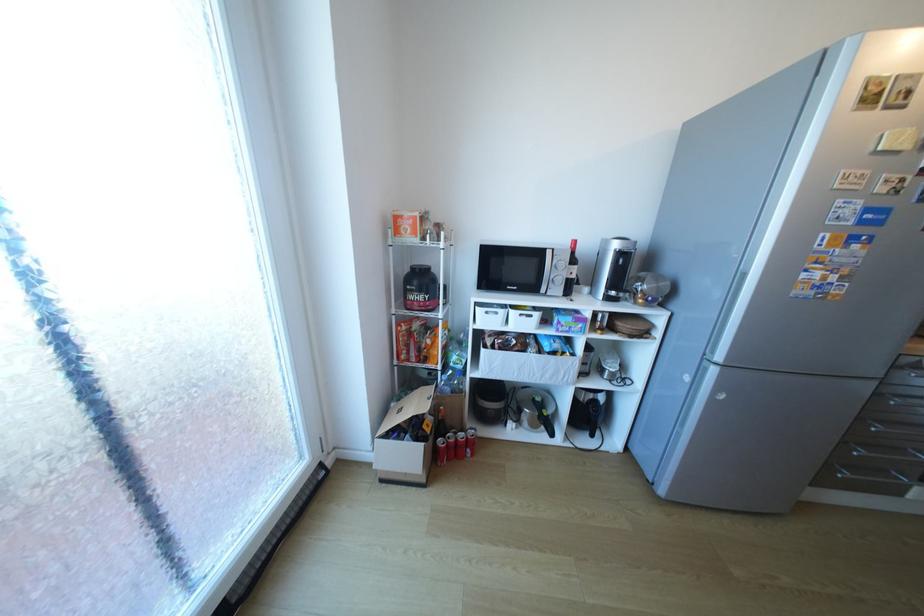
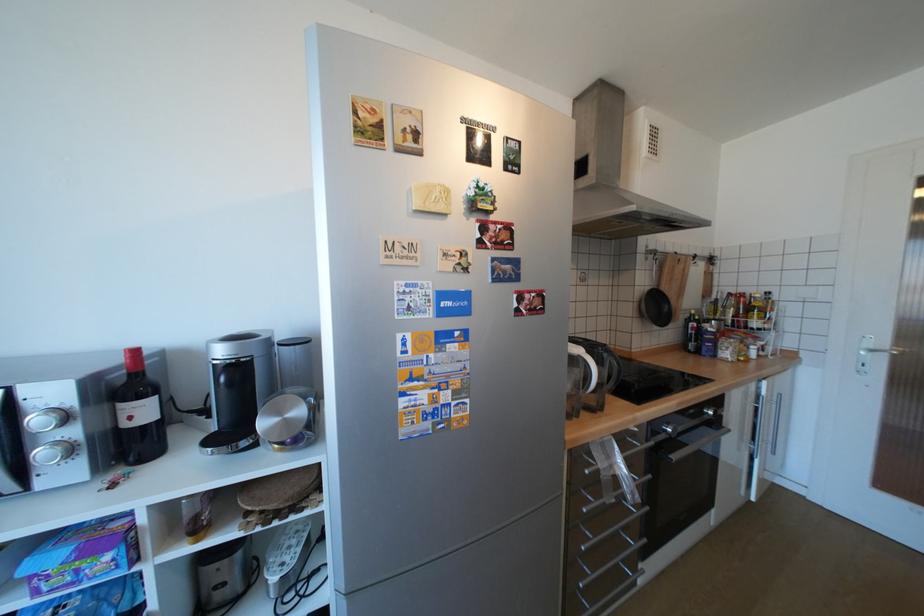
Locate, in the second image, the point that corresponds to [580,274] in the first image.

(140, 418)